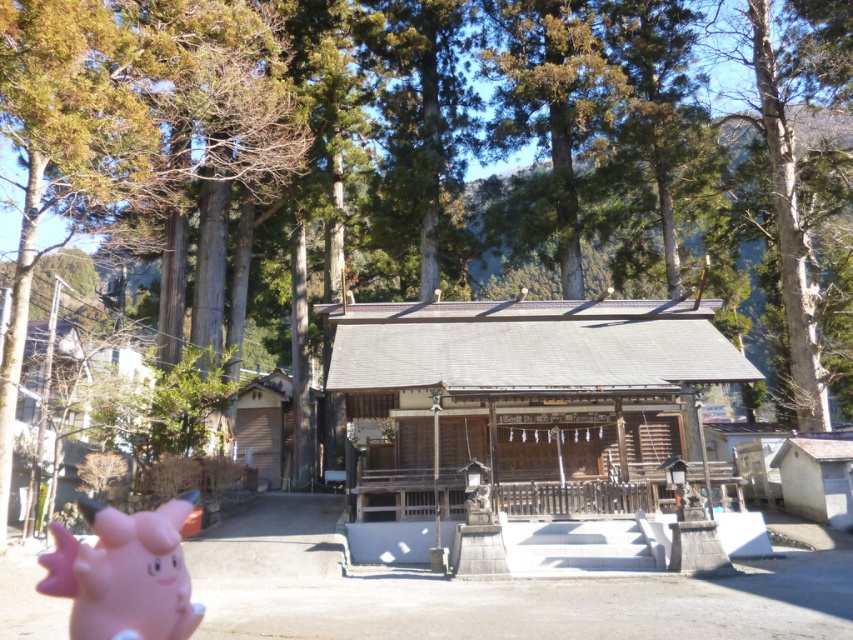
Question: Which point is farther to the camera?

Choices:
 (A) (283, 420)
 (B) (819, 464)

Answer: (A)

Question: Can you confirm if white wood hut at lower right is bigger than wooden gate at left?

Choices:
 (A) no
 (B) yes

Answer: (A)

Question: Considering the relative positions of wooden hut at center and white wood hut at lower right in the image provided, where is wooden hut at center located with respect to white wood hut at lower right?

Choices:
 (A) above
 (B) below

Answer: (A)

Question: Which object is farther from the camera taking this photo?

Choices:
 (A) pink rubber piggy at lower left
 (B) wooden hut at center
 (C) wooden gate at left
 (D) white wood hut at lower right

Answer: (C)

Question: Is wooden hut at center behind white wood hut at lower right?

Choices:
 (A) yes
 (B) no

Answer: (B)

Question: Which point appears closest to the camera in this image?

Choices:
 (A) (830, 451)
 (B) (51, 528)
 (C) (289, 467)

Answer: (B)